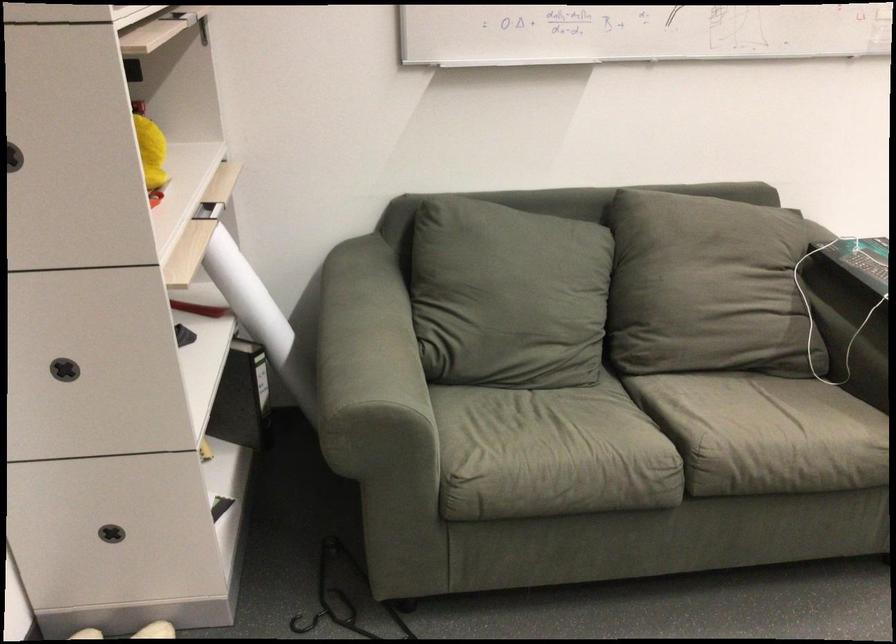
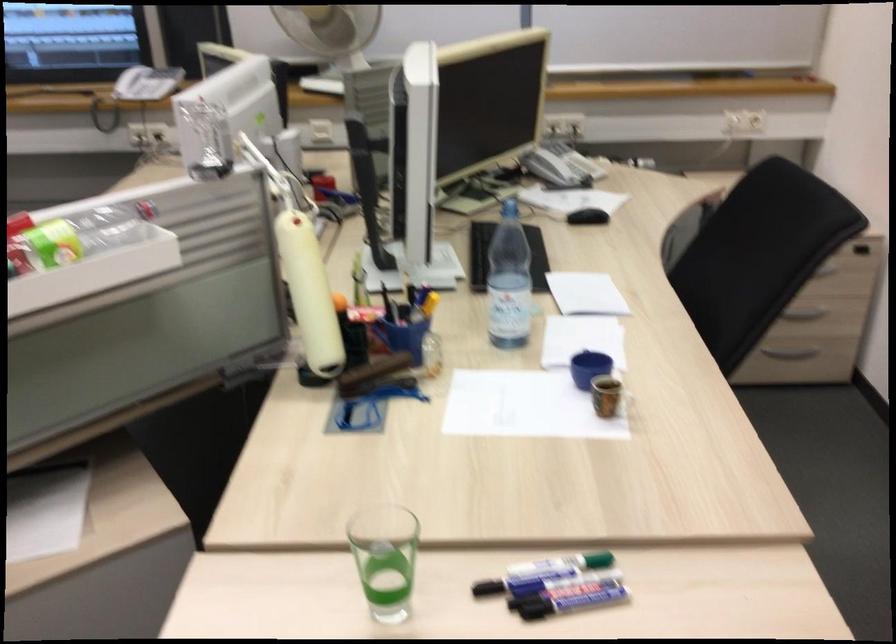
The first image is from the beginning of the video and the second image is from the end. How did the camera likely rotate when shooting the video?

The camera's rotation is toward right-down.